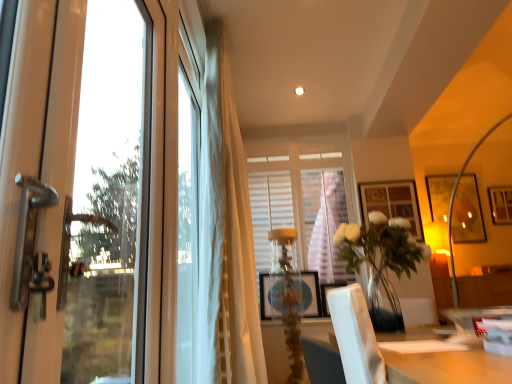
Question: Based on their sizes in the image, would you say clear glass door at left, the first window positioned from the left, is bigger or smaller than white sheer curtain at center?

Choices:
 (A) big
 (B) small

Answer: (B)

Question: Is clear glass door at left, which is counted as the 2th window, starting from the right, inside or outside of white sheer curtain at center?

Choices:
 (A) outside
 (B) inside

Answer: (A)

Question: Considering the real-world distances, which object is closest to the matte black picture frame at center, marked as the fourth picture frame in a right-to-left arrangement?

Choices:
 (A) translucent glass table lamp at center
 (B) clear glass vase at center
 (C) white sheer curtain at center
 (D) matte wooden picture frame at center, the 1th picture frame viewed from the left
 (E) gold-framed picture at right, which ranks as the 4th picture frame in left-to-right order

Answer: (D)

Question: Based on their relative distances, which object is nearer to the white matte window at center, which is the second window in left-to-right order?

Choices:
 (A) transparent glass window screen at left
 (B) matte black picture frame at center, which appears as the 1th picture frame when viewed from the front
 (C) gold-framed picture at right, which is counted as the 2th picture frame, starting from the right
 (D) matte wooden picture frame at center, the 5th picture frame from the right
 (E) wooden framed picture at center right, which ranks as the 3th picture frame in back-to-front order

Answer: (E)